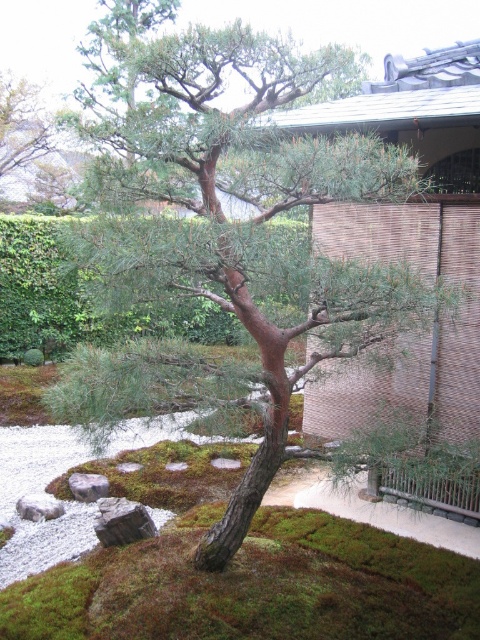
Question: Which object is the farthest from the gray rough stone at lower left?

Choices:
 (A) gray rough rock at lower left
 (B) gray/rough rock at lower left

Answer: (A)

Question: Does gray rough rock at lower left have a greater width compared to gray/rough rock at lower left?

Choices:
 (A) no
 (B) yes

Answer: (B)

Question: Based on their relative distances, which object is farther from the gray rough rock at lower left?

Choices:
 (A) gray rough stone at lower left
 (B) gray/rough rock at lower left

Answer: (B)

Question: Which object is the farthest from the gray rough stone at lower left?

Choices:
 (A) gray rough rock at lower left
 (B) gray/rough rock at lower left

Answer: (A)

Question: Is the position of gray rough stone at lower left more distant than that of gray/rough rock at lower left?

Choices:
 (A) no
 (B) yes

Answer: (A)

Question: Does gray rough rock at lower left have a larger size compared to gray/rough rock at lower left?

Choices:
 (A) yes
 (B) no

Answer: (A)